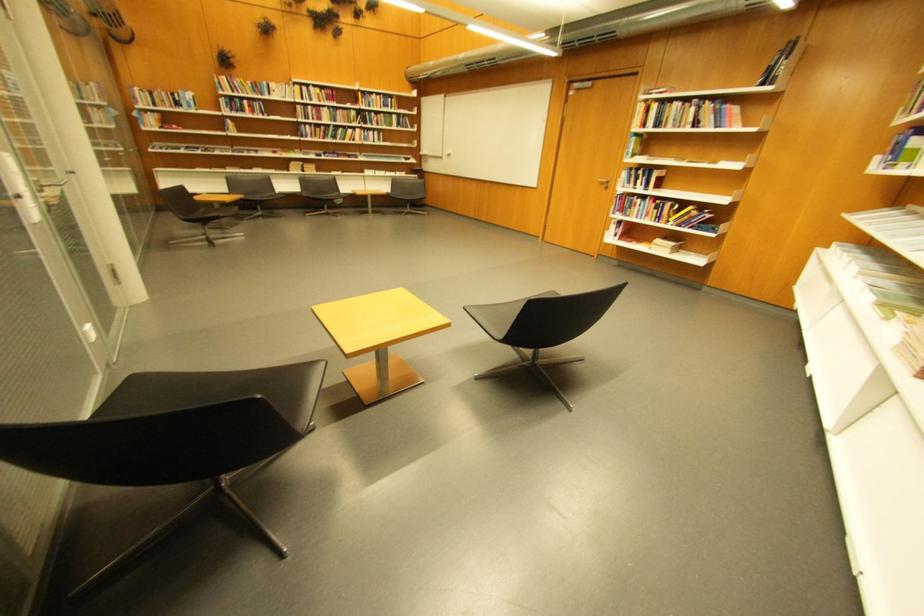
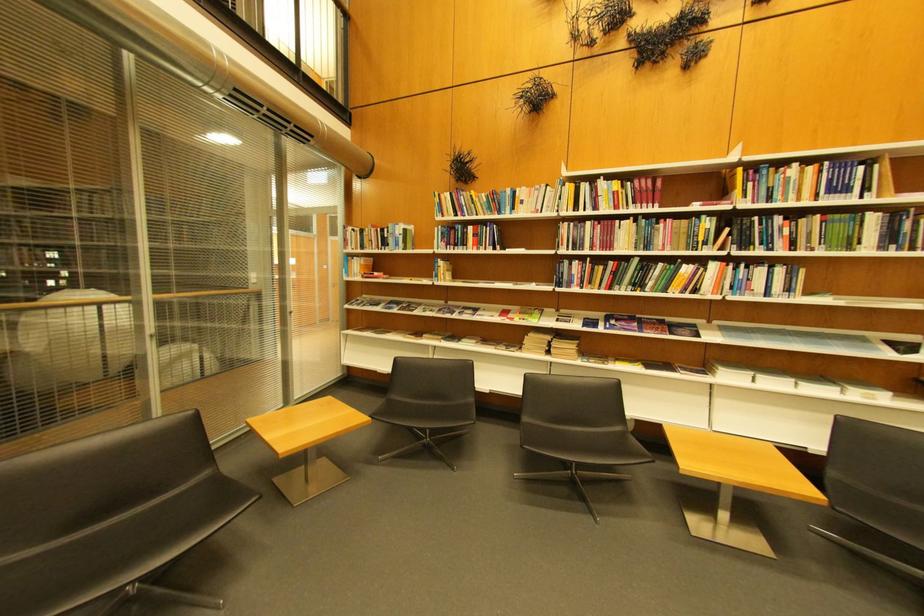
Locate, in the second image, the point that corresponds to pixel 276 95 in the first image.

(518, 209)